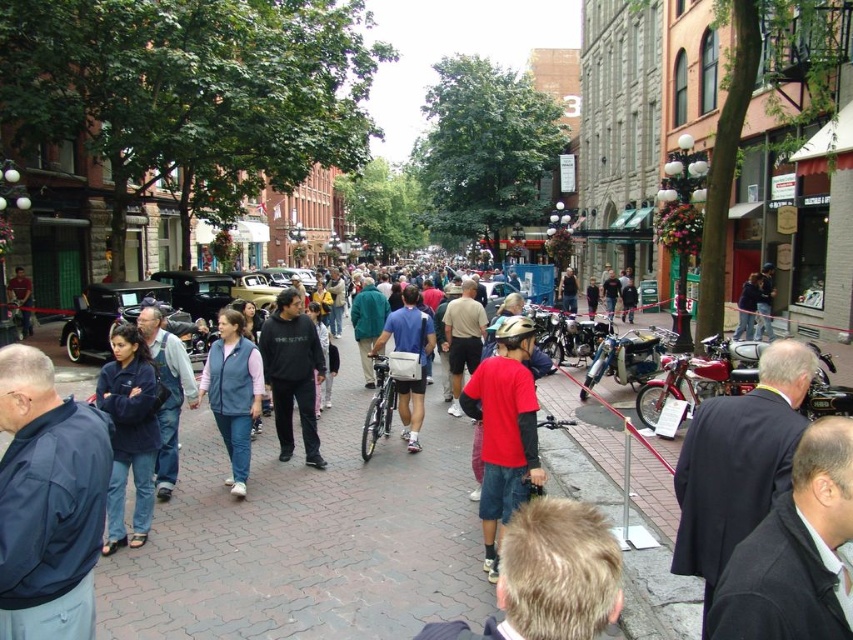
You are a photographer standing in the middle of the street. You want to take a photo of the blonde hair at center and the dark blue fleece jacket at lower left. Which of the two should you focus on first if you want to capture both in a single frame without moving your camera?

You should focus on the blonde hair at center first because it is above the dark blue fleece jacket at lower left, so adjusting focus to the higher object ensures both are within the depth of field.

You are a street vendor trying to place a new stand in the lively street scene. You need to choose between two spots near the dark blue fleece jacket at lower left and the matte gray backpack at center. Which spot would allow you to have more visibility since the object there is larger?

The matte gray backpack at center is larger, so placing the stand near it would provide more visibility as it occupies a more prominent position.